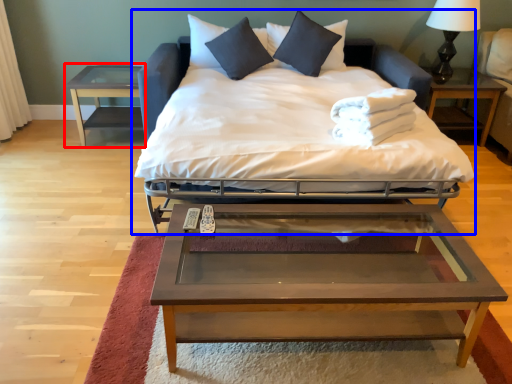
Question: Which of the following is the farthest to the observer, nightstand (highlighted by a red box) or bed (highlighted by a blue box)?

Choices:
 (A) nightstand
 (B) bed

Answer: (A)